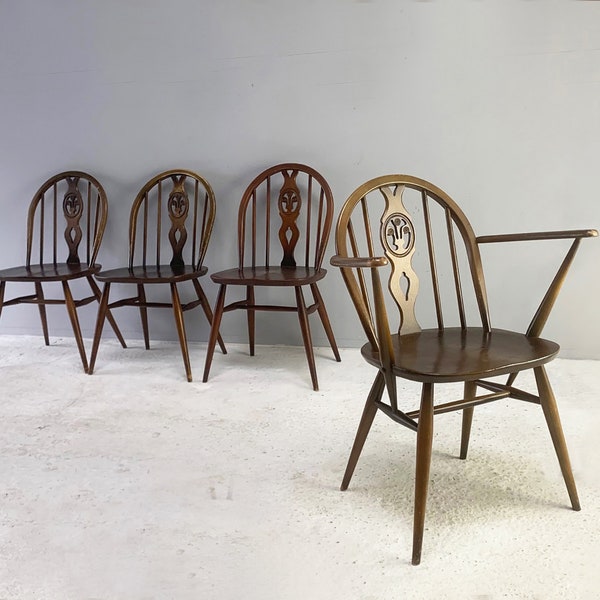
The width and height of the screenshot is (600, 600). In order to click on wooden chair backrest centerpieces in this screenshot , I will do `click(72, 199)`, `click(178, 199)`, `click(289, 196)`, `click(399, 225)`.